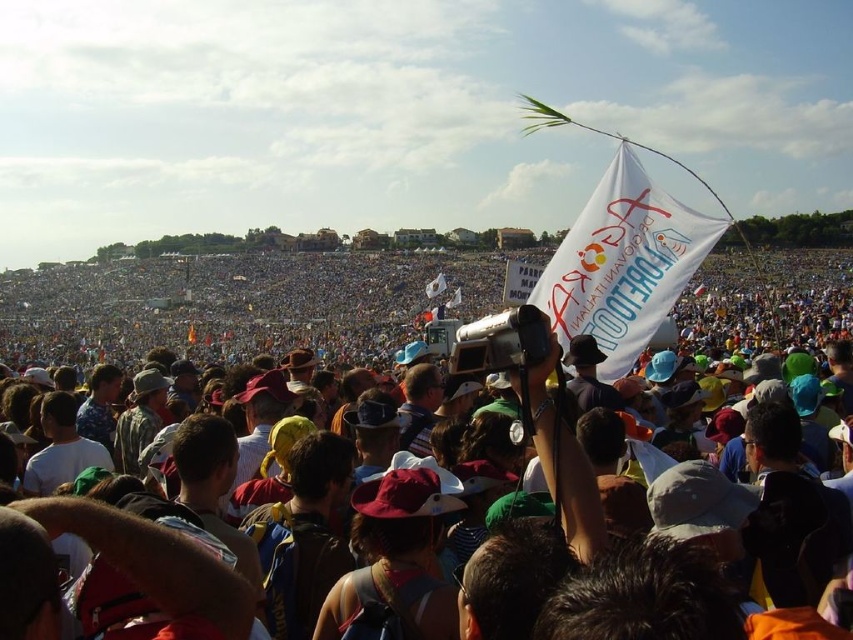
Question: Is white paper flag at center wider than white fabric flag at upper center?

Choices:
 (A) yes
 (B) no

Answer: (A)

Question: Is white paper flag at center positioned at the back of white fabric flag at upper center?

Choices:
 (A) yes
 (B) no

Answer: (B)

Question: Which point is farther from the camera taking this photo?

Choices:
 (A) (170, 266)
 (B) (585, 332)

Answer: (A)

Question: Among these points, which one is farthest from the camera?

Choices:
 (A) (682, 300)
 (B) (611, 378)

Answer: (A)

Question: Considering the relative positions of white paper flag at center and white fabric flag at upper center in the image provided, where is white paper flag at center located with respect to white fabric flag at upper center?

Choices:
 (A) above
 (B) below

Answer: (B)

Question: Which object appears farthest from the camera in this image?

Choices:
 (A) white fabric flag at upper center
 (B) white paper flag at center

Answer: (A)